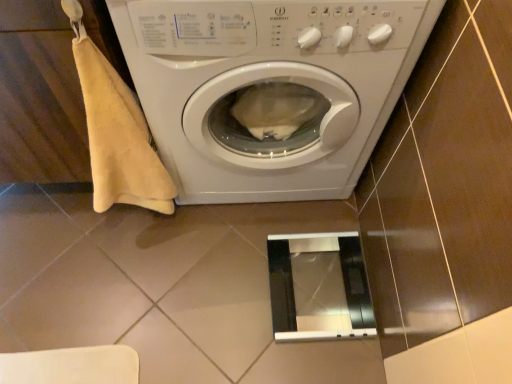
Question: Is metallic silver screen door at lower center not close to beige cotton towel at left?

Choices:
 (A) yes
 (B) no

Answer: (B)

Question: Is metallic silver screen door at lower center facing away from beige cotton towel at left?

Choices:
 (A) yes
 (B) no

Answer: (B)

Question: Does metallic silver screen door at lower center turn towards beige cotton towel at left?

Choices:
 (A) no
 (B) yes

Answer: (A)

Question: Considering the relative positions of metallic silver screen door at lower center and beige cotton towel at left in the image provided, is metallic silver screen door at lower center to the left of beige cotton towel at left from the viewer's perspective?

Choices:
 (A) no
 (B) yes

Answer: (A)

Question: From a real-world perspective, is metallic silver screen door at lower center on beige cotton towel at left?

Choices:
 (A) yes
 (B) no

Answer: (B)

Question: Is metallic silver screen door at lower center beside beige cotton towel at left?

Choices:
 (A) no
 (B) yes

Answer: (A)

Question: Is metallic silver screen door at lower center surrounding white glossy washing machine at center?

Choices:
 (A) no
 (B) yes

Answer: (A)

Question: Is metallic silver screen door at lower center bigger than white glossy washing machine at center?

Choices:
 (A) no
 (B) yes

Answer: (A)

Question: Considering the relative sizes of metallic silver screen door at lower center and white glossy washing machine at center in the image provided, is metallic silver screen door at lower center wider than white glossy washing machine at center?

Choices:
 (A) no
 (B) yes

Answer: (A)

Question: Could you tell me if metallic silver screen door at lower center is turned towards white glossy washing machine at center?

Choices:
 (A) yes
 (B) no

Answer: (B)

Question: Is metallic silver screen door at lower center at the right side of white glossy washing machine at center?

Choices:
 (A) no
 (B) yes

Answer: (B)

Question: Considering the relative sizes of metallic silver screen door at lower center and white glossy washing machine at center in the image provided, is metallic silver screen door at lower center thinner than white glossy washing machine at center?

Choices:
 (A) no
 (B) yes

Answer: (B)

Question: Are white glossy washing machine at center and metallic silver screen door at lower center located far from each other?

Choices:
 (A) no
 (B) yes

Answer: (A)